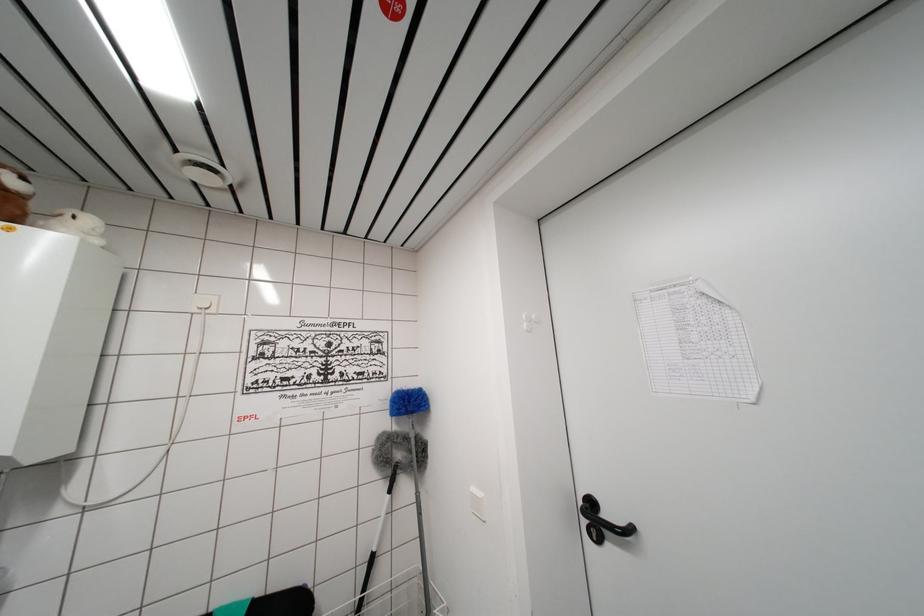
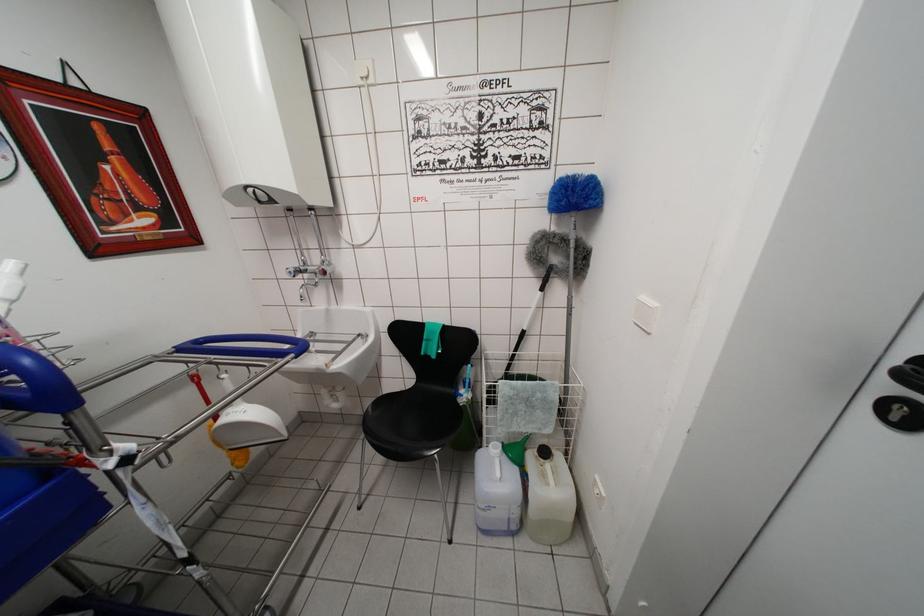
Find the pixel in the second image that matches point (599, 543) in the first image.

(897, 423)